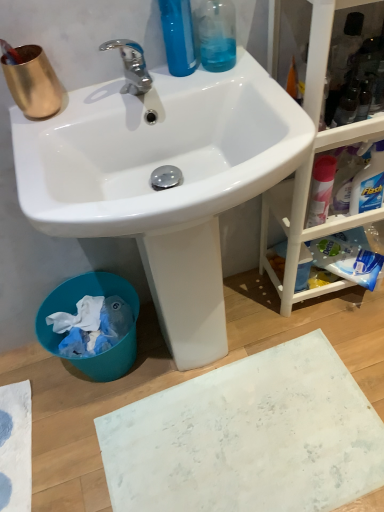
Locate an element on the screen. The height and width of the screenshot is (512, 384). vacant area that lies to the right of gold metallic cup at upper left is located at coordinates (104, 98).